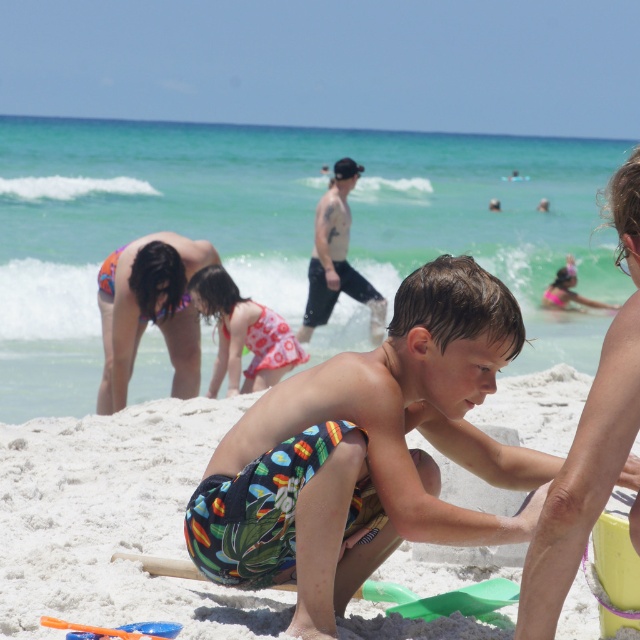
Question: Can you confirm if printed fabric shorts at center is positioned to the left of translucent plastic shovel at lower left?

Choices:
 (A) no
 (B) yes

Answer: (A)

Question: Does printed fabric shorts at center have a greater width compared to pink dotted swimsuit at center?

Choices:
 (A) yes
 (B) no

Answer: (A)

Question: Which point is closer to the camera taking this photo?

Choices:
 (A) (48, 625)
 (B) (486, 321)
 (C) (276, 333)
 (D) (116, 404)

Answer: (B)

Question: Does pink dotted swimsuit at center appear on the right side of translucent plastic shovel at lower left?

Choices:
 (A) yes
 (B) no

Answer: (B)

Question: Which point is farther from the camera taking this photo?

Choices:
 (A) (49, 616)
 (B) (308, 300)
 (C) (108, 570)
 (D) (260, 326)

Answer: (B)

Question: Among these objects, which one is farthest from the camera?

Choices:
 (A) white sandy beach at center
 (B) skinny white man at center
 (C) printed bikini at lower left
 (D) printed fabric shorts at center

Answer: (B)